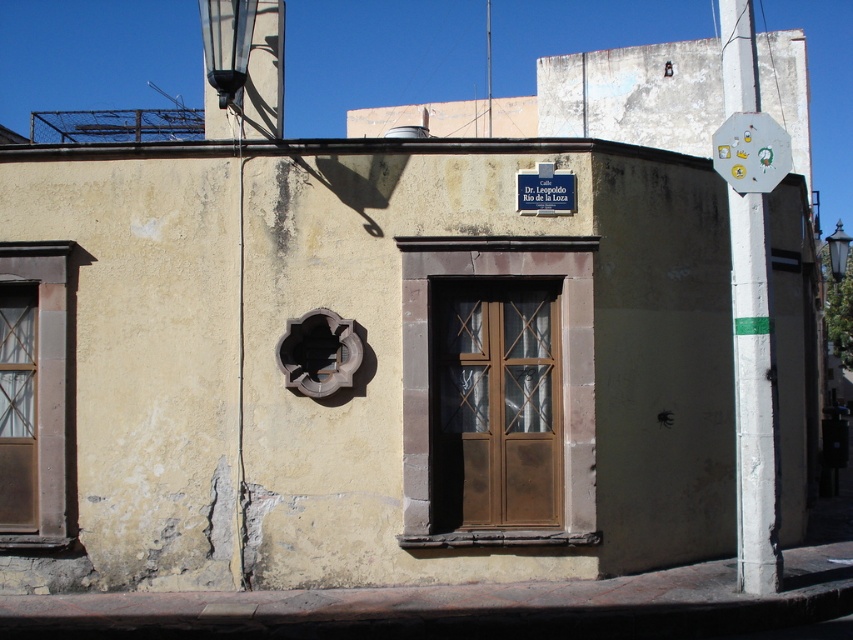
Question: Is brown wooden door at center smaller than metallic octagonal sign at upper right?

Choices:
 (A) yes
 (B) no

Answer: (B)

Question: Considering the relative positions of brown wooden door at center and matte brown window at left in the image provided, where is brown wooden door at center located with respect to matte brown window at left?

Choices:
 (A) right
 (B) left

Answer: (A)

Question: Which of the following is the closest to the observer?

Choices:
 (A) (469, 388)
 (B) (9, 260)

Answer: (B)

Question: Which point appears farthest from the camera in this image?

Choices:
 (A) (775, 177)
 (B) (30, 259)
 (C) (491, 486)

Answer: (C)

Question: Which of the following is the closest to the observer?

Choices:
 (A) (32, 420)
 (B) (444, 296)

Answer: (B)

Question: Can you confirm if brown wooden door at center is bigger than metallic octagonal sign at upper right?

Choices:
 (A) yes
 (B) no

Answer: (A)